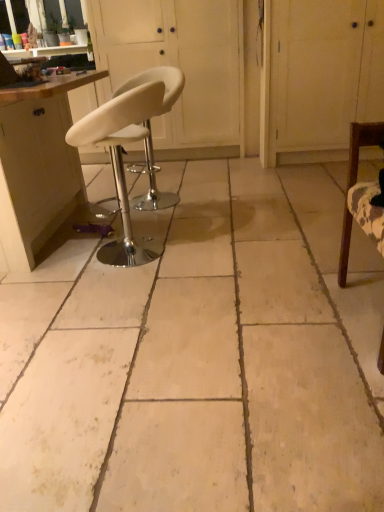
Locate an element on the screen. The width and height of the screenshot is (384, 512). blank space above beige tile floor at center (from a real-world perspective) is located at coordinates (192, 260).